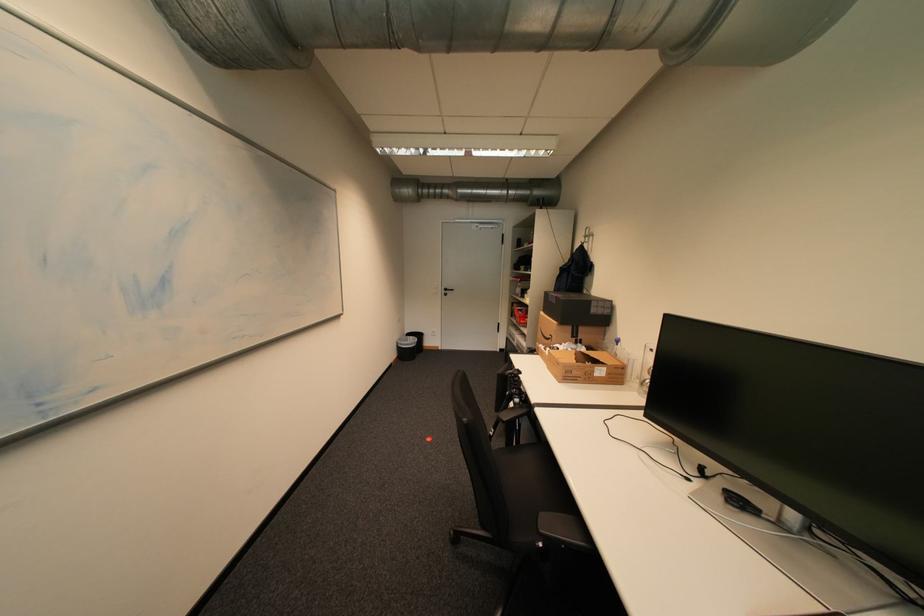
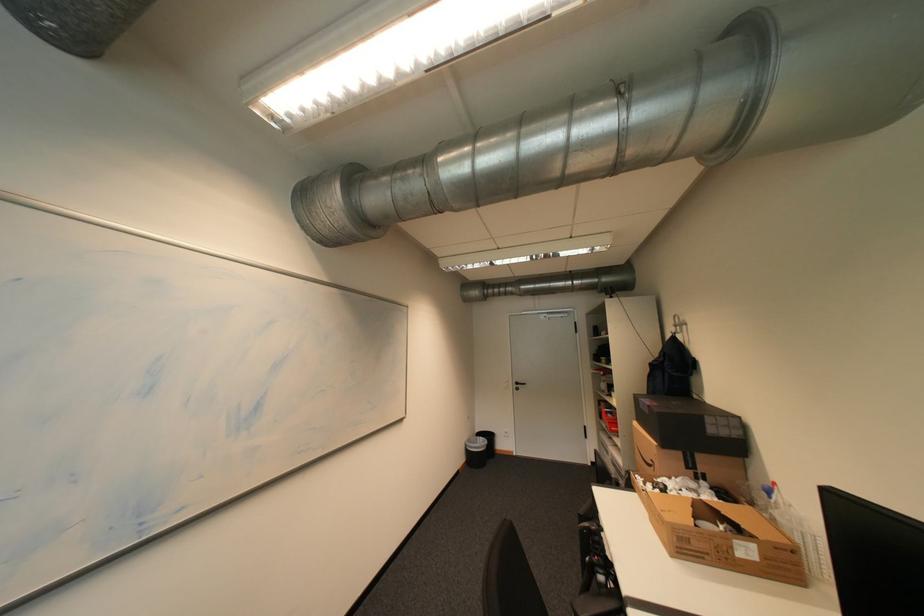
Question: What movement of the cameraman would produce the second image?

Choices:
 (A) Left
 (B) Right
 (C) Forward
 (D) Backward

Answer: (B)